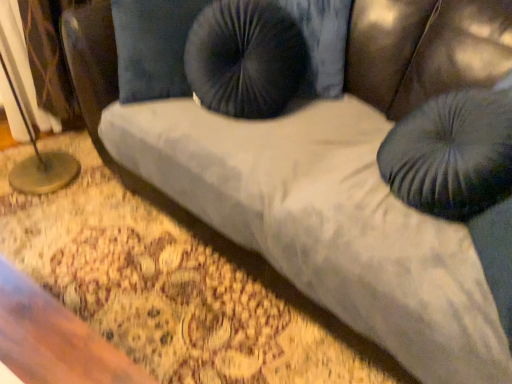
Question: Do you think velvet dark blue bean bag at upper center is within suede-like black pillow at center, or outside of it?

Choices:
 (A) outside
 (B) inside

Answer: (A)

Question: Considering the relative positions of velvet dark blue bean bag at upper center and suede-like black pillow at center in the image provided, is velvet dark blue bean bag at upper center to the left or to the right of suede-like black pillow at center?

Choices:
 (A) right
 (B) left

Answer: (A)

Question: Which object is positioned farthest from the suede-like black pillow at center?

Choices:
 (A) metallic gold table lamp at left
 (B) velvet dark blue bean bag at upper center

Answer: (B)

Question: Which of these objects is positioned farthest from the velvet dark blue bean bag at upper center?

Choices:
 (A) suede-like black pillow at center
 (B) metallic gold table lamp at left

Answer: (B)